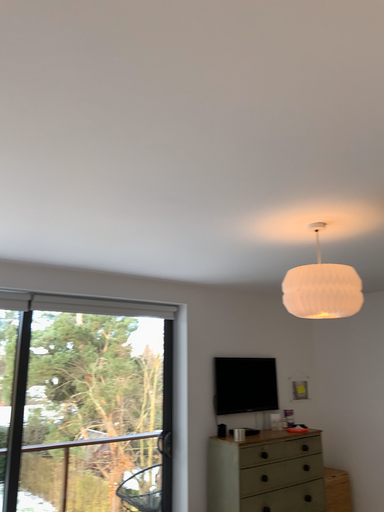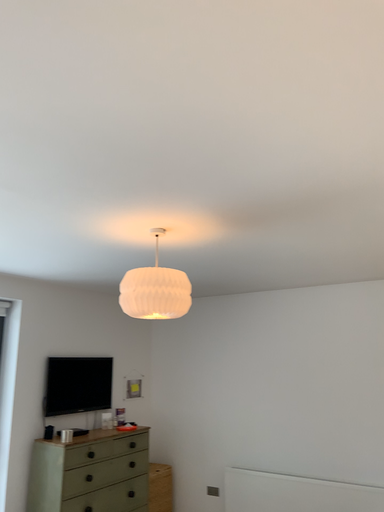
Question: Which way did the camera rotate in the video?

Choices:
 (A) rotated right
 (B) rotated left

Answer: (A)